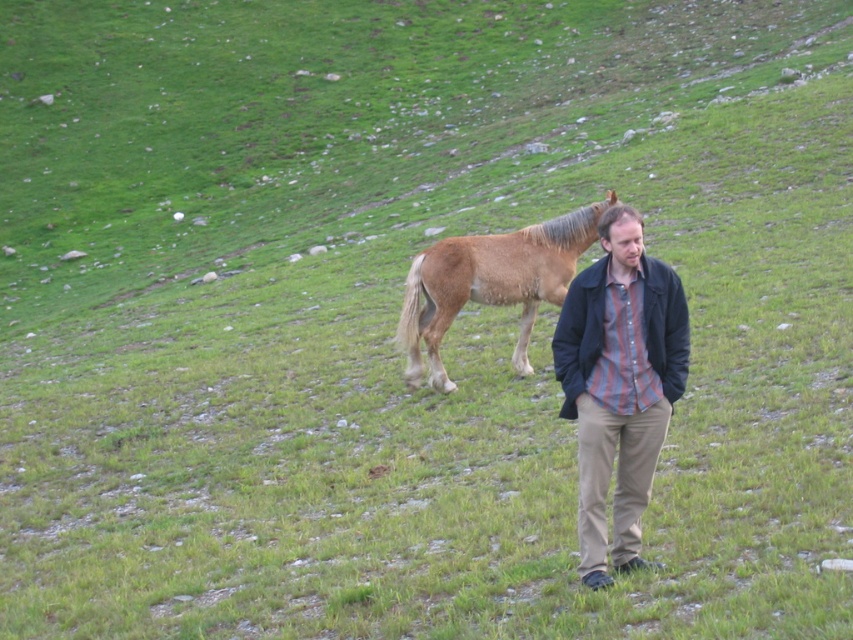
Can you confirm if striped cotton shirt at center is taller than brown fuzzy horse at center?

Indeed, striped cotton shirt at center has a greater height compared to brown fuzzy horse at center.

Who is more forward, [654,404] or [541,288]?

Point [654,404]

Is point (634, 552) closer to viewer compared to point (538, 237)?

Yes, point (634, 552) is in front of point (538, 237).

Locate an element on the screen. The height and width of the screenshot is (640, 853). striped cotton shirt at center is located at coordinates 619,385.